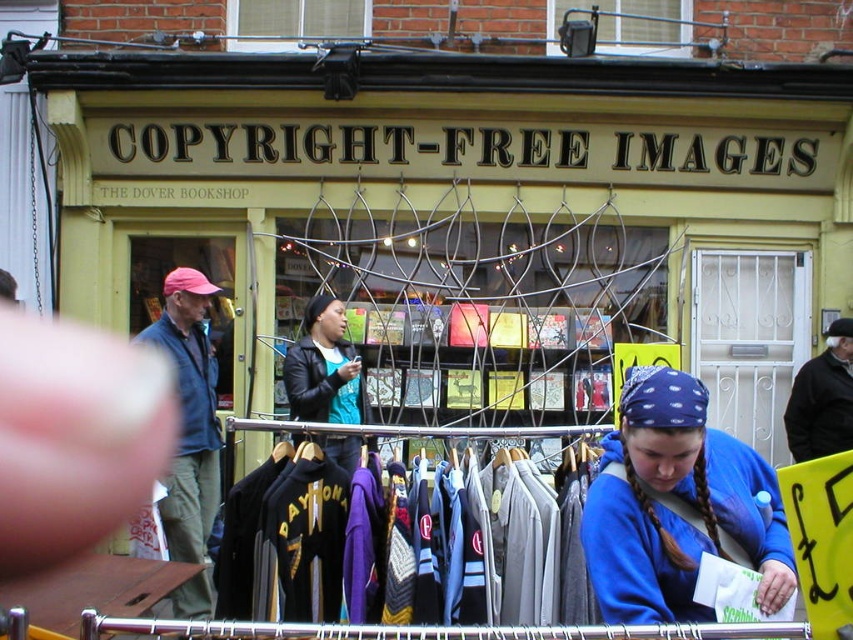
Which is behind, point (492, 464) or point (177, 509)?

Positioned behind is point (177, 509).

Which of these two, black fleece sweatshirt at center or denim jacket at left, stands taller?

Standing taller between the two is denim jacket at left.

Is point (451, 490) positioned behind point (201, 339)?

No, it is not.

This screenshot has height=640, width=853. I want to click on black fleece sweatshirt at center, so click(x=479, y=545).

Does metallic wire mesh at center have a smaller size compared to blue fleece sweatshirt at lower right?

Actually, metallic wire mesh at center might be larger than blue fleece sweatshirt at lower right.

Does point (468, 273) come farther from viewer compared to point (769, 518)?

Yes.

Looking at this image, who is more forward, (280, 260) or (619, 468)?

Point (619, 468)

Find the location of `metallic wire mesh at center`. metallic wire mesh at center is located at coordinates (480, 305).

Which is above, black fleece sweatshirt at center or leather jacket at center?

leather jacket at center

Is black fleece sweatshirt at center wider than leather jacket at center?

Indeed, black fleece sweatshirt at center has a greater width compared to leather jacket at center.

Locate an element on the screen. black fleece sweatshirt at center is located at coordinates (479, 545).